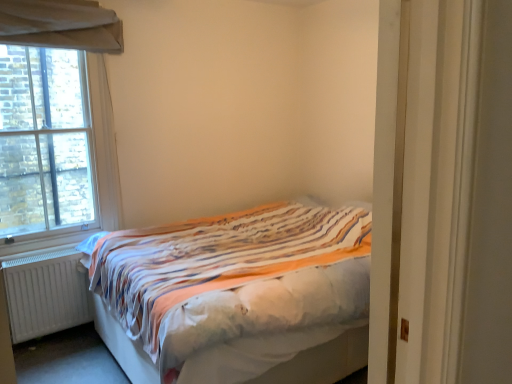
Question: Choose the correct answer: Is white matte radiator at lower left inside striped fabric bed at center or outside it?

Choices:
 (A) inside
 (B) outside

Answer: (B)

Question: Considering their positions, is white matte radiator at lower left located in front of or behind striped fabric bed at center?

Choices:
 (A) front
 (B) behind

Answer: (B)

Question: Based on their relative distances, which object is nearer to the striped fabric bed at center?

Choices:
 (A) white matte radiator at lower left
 (B) white wooden door at right
 (C) brick textured window at left

Answer: (A)

Question: Estimate the real-world distances between objects in this image. Which object is closer to the striped fabric bed at center?

Choices:
 (A) white wooden door at right
 (B) brick textured window at left
 (C) white matte radiator at lower left

Answer: (C)